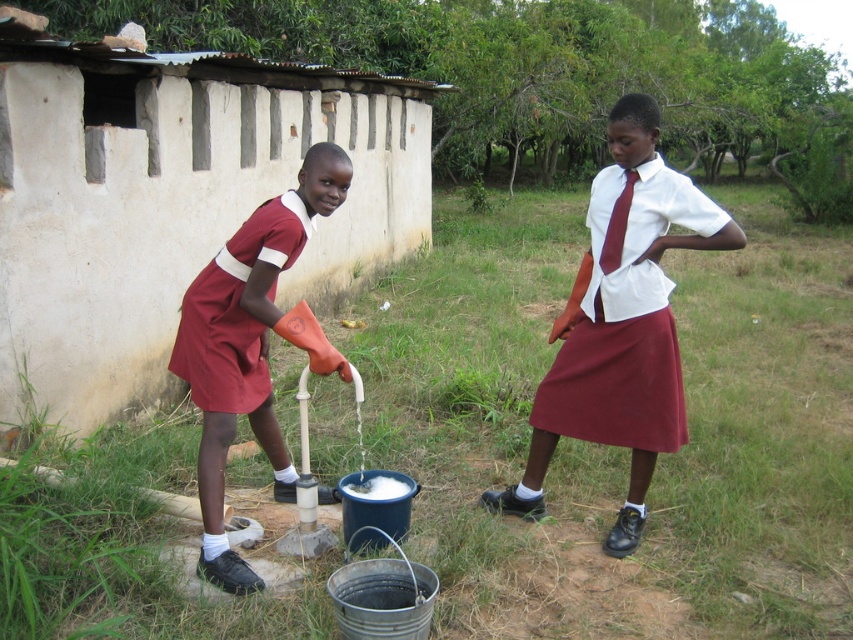
You are a photographer taking a picture of the matte white shirt at center and the maroon fabric dress at left. Which one should you focus on first if you want to capture both clearly in the same frame?

The matte white shirt at center is below the maroon fabric dress at left, so you should focus on the maroon fabric dress at left first to ensure both are in focus since it is closer to the camera.

You are a fashion designer analyzing the image. Which maroon fabric dress has a wider silhouette between the maroon fabric dress at center and the maroon fabric dress at left?

The maroon fabric dress at center has a wider silhouette than the maroon fabric dress at left because its width surpasses the latter.

You are a photographer trying to capture both the maroon fabric dress at right and the maroon fabric dress at left in a single frame. Based on their positions, which dress is closer to the camera?

The maroon fabric dress at right is positioned under maroon fabric dress at left, so the maroon fabric dress at left is closer to the camera.